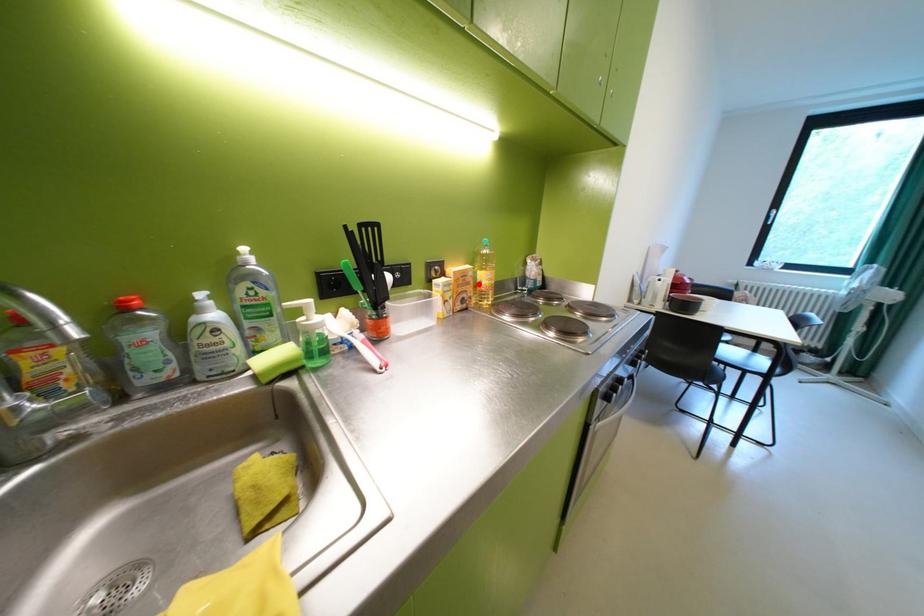
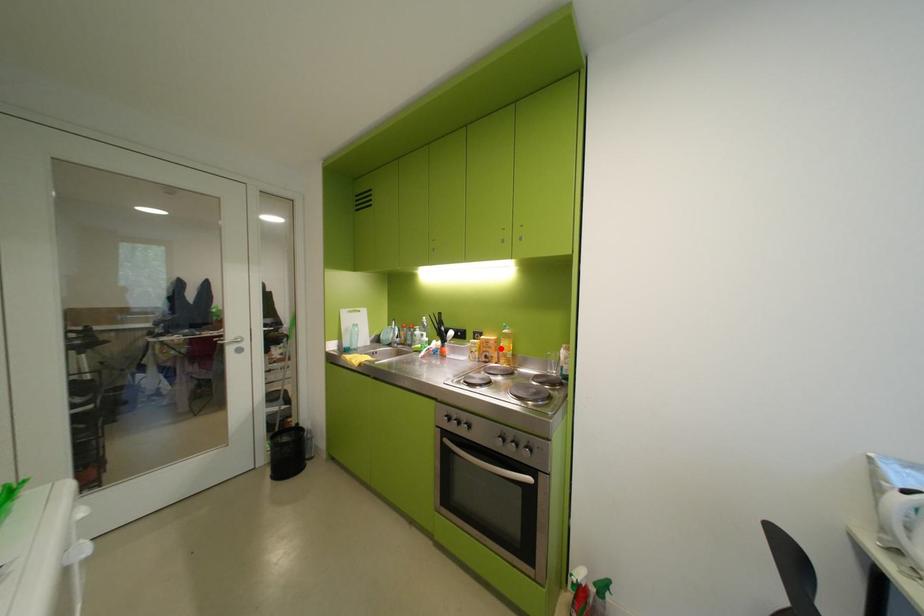
I am providing you with two images of the same scene from different viewpoints. A red point is marked on the first image and another point is marked on the second image. Does the point marked in image1 correspond to the same location as the one in image2?

Yes